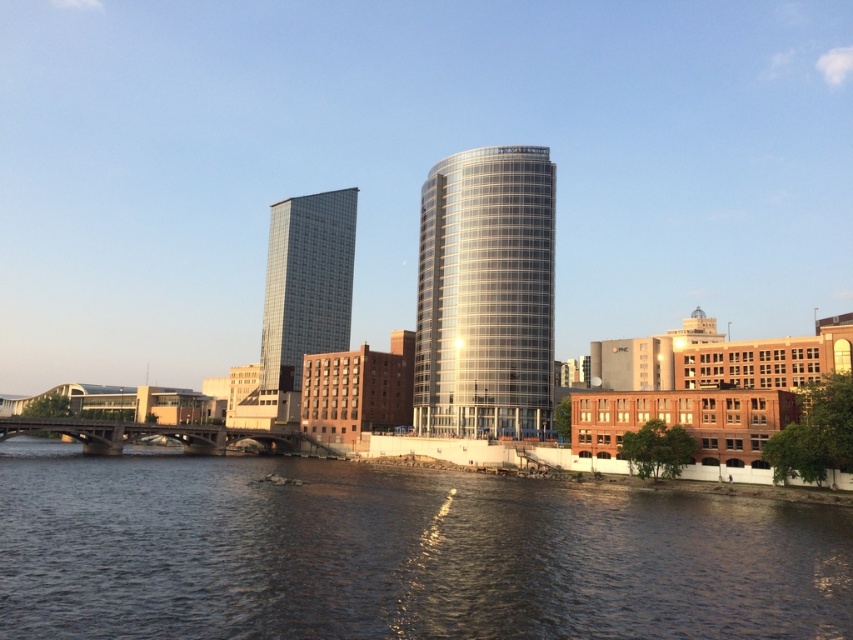
Which is more to the left, dark blue water at center or glassy reflective skyscraper at center?

glassy reflective skyscraper at center

Which is behind, point (178, 522) or point (287, 305)?

The point (287, 305) is more distant.

At what (x,y) coordinates should I click in order to perform the action: click on dark blue water at center. Please return your answer as a coordinate pair (x, y). The image size is (853, 640). Looking at the image, I should click on (396, 554).

Is dark blue water at center shorter than shiny glass tower at center?

Indeed, dark blue water at center has a lesser height compared to shiny glass tower at center.

Is dark blue water at center positioned behind shiny glass tower at center?

No, it is not.

What do you see at coordinates (396, 554) in the screenshot? The width and height of the screenshot is (853, 640). I see `dark blue water at center` at bounding box center [396, 554].

You are a GUI agent. You are given a task and a screenshot of the screen. Output one action in this format:
    pyautogui.click(x=<x>, y=<y>)
    Task: Click on the dark blue water at center
    
    Given the screenshot: What is the action you would take?
    pyautogui.click(x=396, y=554)

Which is in front, point (515, 241) or point (294, 326)?

Point (515, 241) is in front.

Who is positioned more to the left, shiny glass tower at center or glassy reflective skyscraper at center?

glassy reflective skyscraper at center is more to the left.

Who is more forward, (x=494, y=436) or (x=268, y=342)?

Positioned in front is point (x=494, y=436).

Locate an element on the screen. The width and height of the screenshot is (853, 640). shiny glass tower at center is located at coordinates (485, 294).